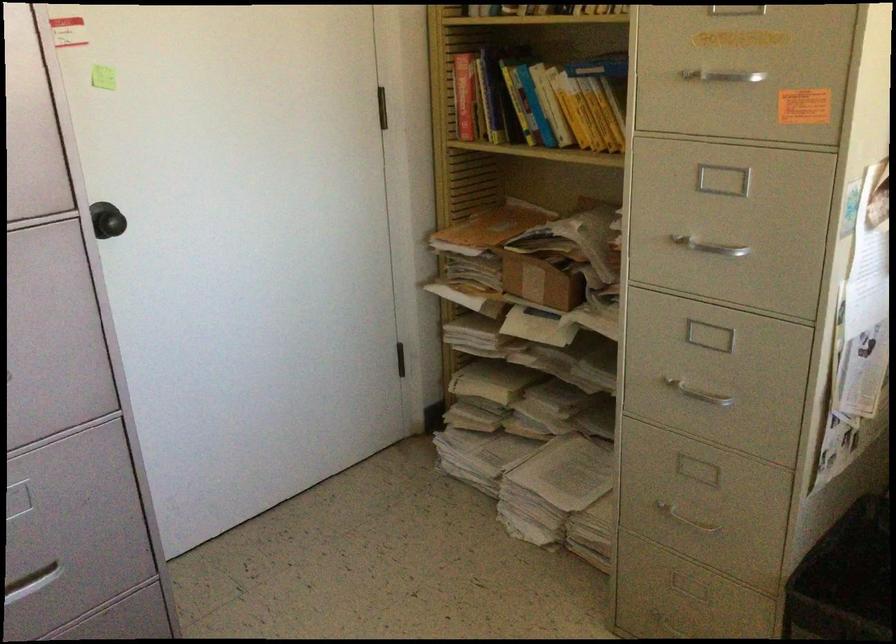
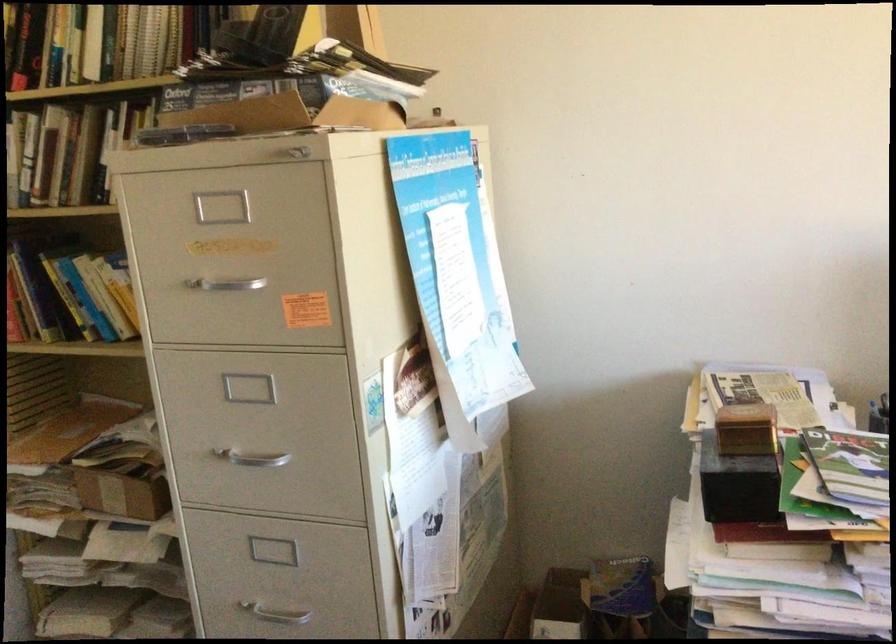
Locate, in the second image, the point that corresponds to the point at 688,388 in the first image.

(273, 608)